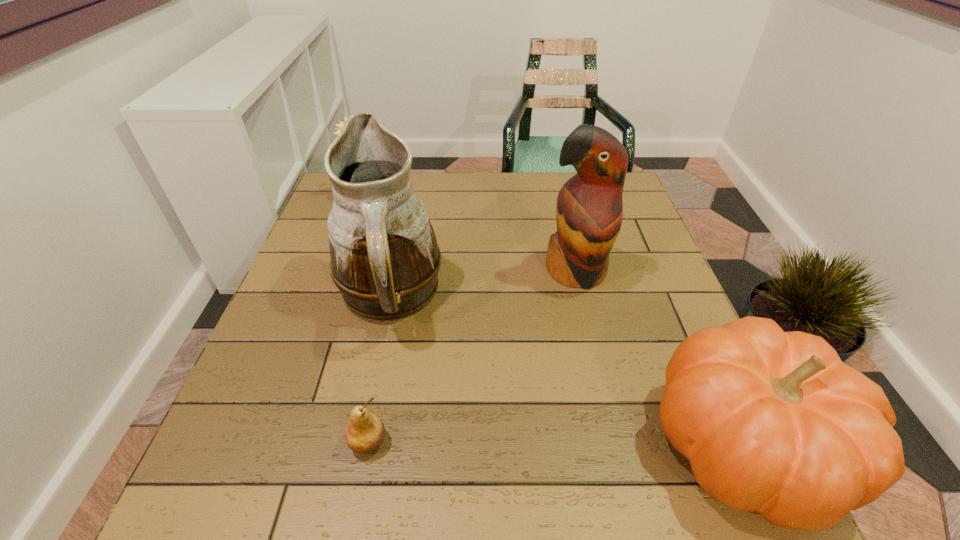
You are a GUI agent. You are given a task and a screenshot of the screen. Output one action in this format:
    pyautogui.click(x=<x>, y=<y>)
    Task: Click on the free space on the desktop that is between the shortest object and the pumpkin and is positioned on the front-facing side of the farthest object
    This screenshot has width=960, height=540.
    Given the screenshot: What is the action you would take?
    pyautogui.click(x=516, y=442)

Locate an element on the screen. This screenshot has height=540, width=960. free space on the desktop that is between the pear and the pumpkin and is positioned from the spout of the pitcher is located at coordinates (592, 442).

Identify the location of free space on the desktop that is between the pear and the pumpkin and is positioned on the face of the parrot. The width and height of the screenshot is (960, 540). (584, 442).